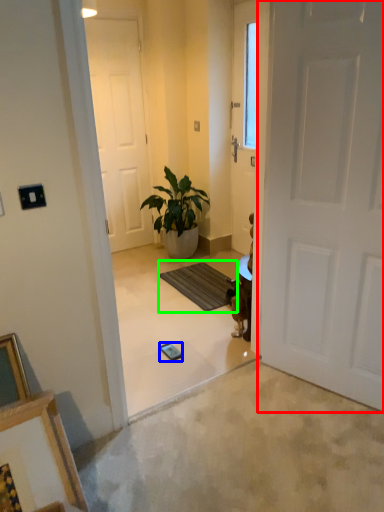
Question: Which object is positioned farthest from door (highlighted by a red box)? Select from mobile phone (highlighted by a blue box) and doormat (highlighted by a green box).

Choices:
 (A) mobile phone
 (B) doormat

Answer: (B)